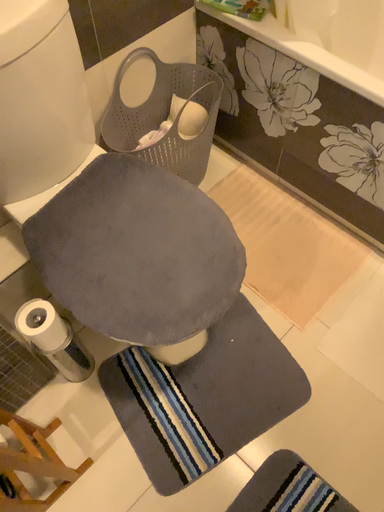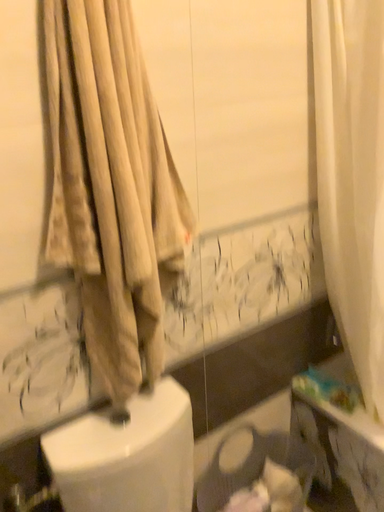
Question: Which way did the camera rotate in the video?

Choices:
 (A) rotated left
 (B) rotated right

Answer: (A)